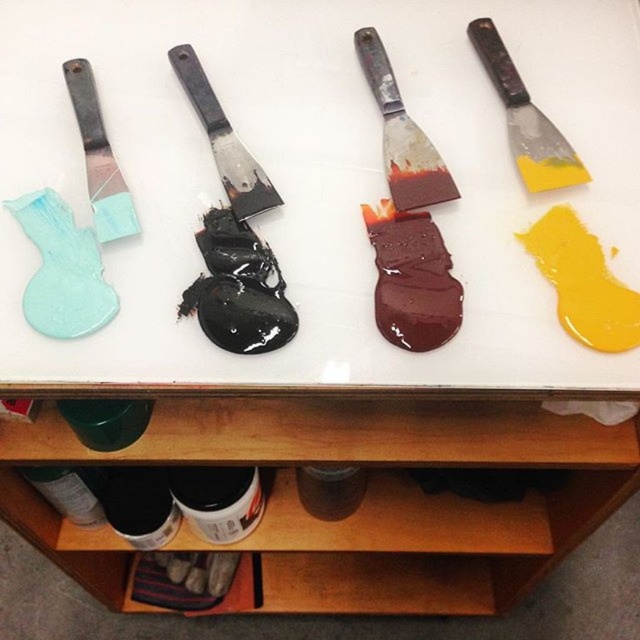
Can you confirm if black matte spatula at center is shorter than matte plastic spatula at left?

Indeed, black matte spatula at center has a lesser height compared to matte plastic spatula at left.

The image size is (640, 640). Describe the element at coordinates (224, 140) in the screenshot. I see `black matte spatula at center` at that location.

Locate an element on the screen. Image resolution: width=640 pixels, height=640 pixels. black matte spatula at center is located at coordinates (224, 140).

Is satin red spatula at center to the right of yellow matte spatula at upper right from the viewer's perspective?

In fact, satin red spatula at center is to the left of yellow matte spatula at upper right.

Is satin red spatula at center thinner than yellow matte spatula at upper right?

Yes.

Is point (438, 176) in front of point (522, 150)?

That is True.

Image resolution: width=640 pixels, height=640 pixels. I want to click on satin red spatula at center, so click(x=401, y=134).

Does yellow matte spatula at upper right have a greater width compared to black matte spatula at center?

Incorrect, yellow matte spatula at upper right's width does not surpass black matte spatula at center's.

Who is positioned more to the right, yellow matte spatula at upper right or black matte spatula at center?

yellow matte spatula at upper right

Where is `yellow matte spatula at upper right`? yellow matte spatula at upper right is located at coordinates (525, 120).